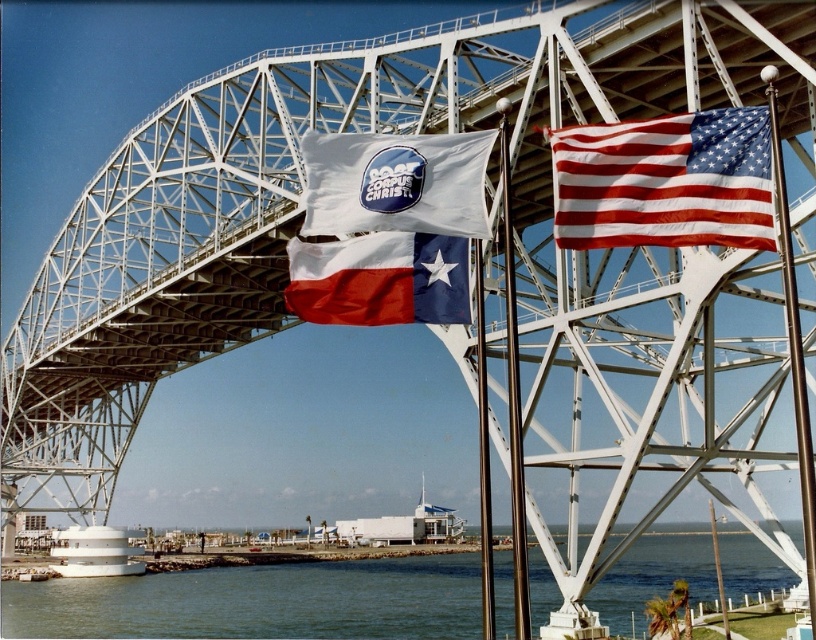
Question: Which point appears farthest from the camera in this image?

Choices:
 (A) (418, 152)
 (B) (386, 266)

Answer: (B)

Question: Does green water at lower center have a smaller size compared to red-white-blue fabric texas flag at center?

Choices:
 (A) yes
 (B) no

Answer: (B)

Question: Which object is positioned farthest from the green water at lower center?

Choices:
 (A) red-white-blue fabric texas flag at center
 (B) american flag at upper right

Answer: (A)

Question: Which point is closer to the camera taking this photo?

Choices:
 (A) (375, 285)
 (B) (65, 584)

Answer: (A)

Question: Observing the image, what is the correct spatial positioning of green water at lower center in reference to white fabric flag at center?

Choices:
 (A) left
 (B) right

Answer: (B)

Question: Is green water at lower center positioned before red-white-blue fabric texas flag at center?

Choices:
 (A) no
 (B) yes

Answer: (A)